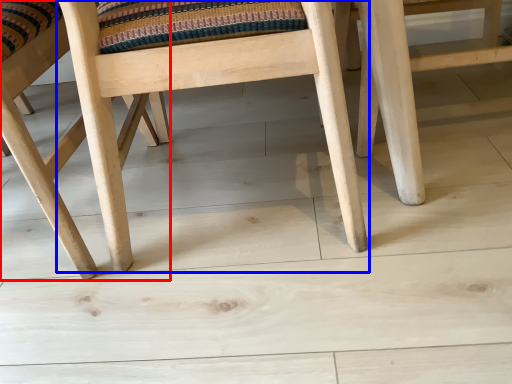
Question: Which object is closer to the camera taking this photo, chair (highlighted by a red box) or chair (highlighted by a blue box)?

Choices:
 (A) chair
 (B) chair

Answer: (B)